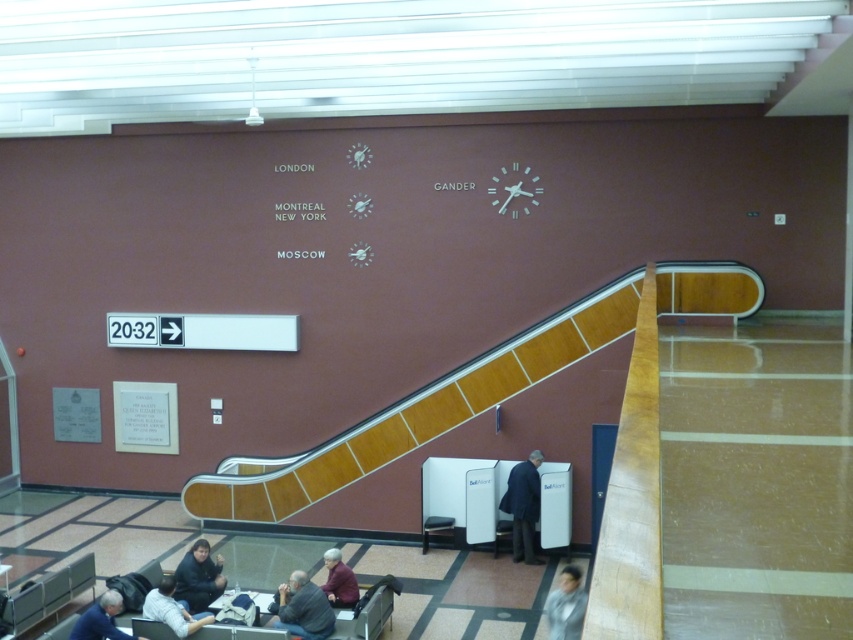
Question: In this image, where is dark gray suit at center located relative to maroon sweater at lower center?

Choices:
 (A) left
 (B) right

Answer: (B)

Question: Which point is farther to the camera?

Choices:
 (A) dark gray sweater at lower center
 (B) dark blue shirt at lower left
 (C) dark gray sweater at lower left
 (D) dark blue jacket at lower left

Answer: (D)

Question: Which of these objects is positioned closest to the dark gray suit at center?

Choices:
 (A) dark blue shirt at lower left
 (B) dark blue jacket at lower left

Answer: (B)

Question: Does dark gray sweater at lower center appear on the right side of maroon sweater at lower center?

Choices:
 (A) yes
 (B) no

Answer: (B)

Question: Which is nearer to the dark gray sweater at lower left?

Choices:
 (A) dark blue shirt at lower left
 (B) gray fabric jacket at lower right
 (C) dark blue jacket at lower left
 (D) maroon sweater at lower center

Answer: (A)

Question: Can you confirm if dark gray suit at center is positioned to the right of dark blue shirt at lower left?

Choices:
 (A) no
 (B) yes

Answer: (B)